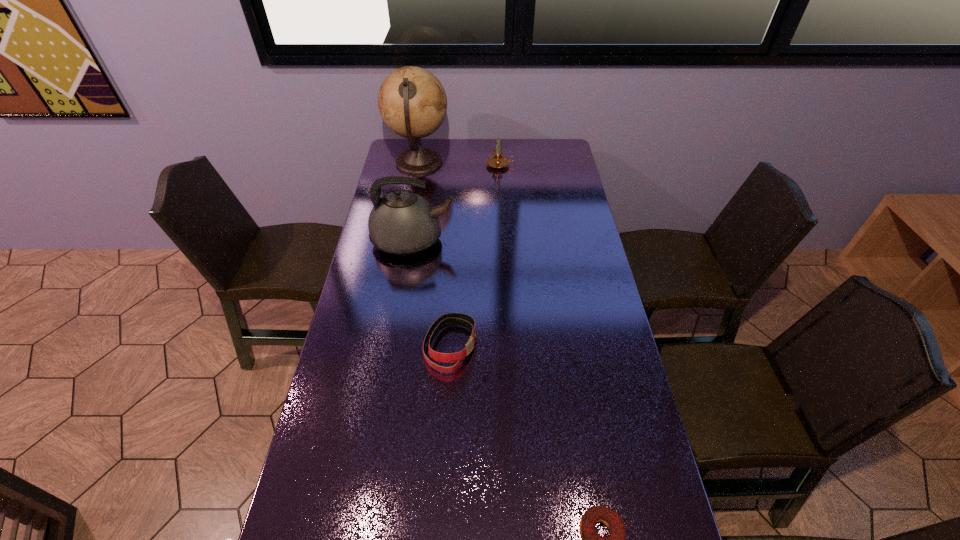
Identify the location of vacant area between the fourth farthest object and the second tallest object. This screenshot has height=540, width=960. (432, 293).

Locate an element on the screen. The image size is (960, 540). vacant region between the fourth tallest object and the third farthest object is located at coordinates (432, 293).

You are a GUI agent. You are given a task and a screenshot of the screen. Output one action in this format:
    pyautogui.click(x=<x>, y=<y>)
    Task: Click on the free space between the second object from right to left and the second shortest object
    The width and height of the screenshot is (960, 540).
    Given the screenshot: What is the action you would take?
    pyautogui.click(x=475, y=255)

Image resolution: width=960 pixels, height=540 pixels. Identify the location of unoccupied position between the fourth object from left to right and the tallest object. (460, 164).

In order to click on empty space between the kettle and the candle in this screenshot , I will do click(x=457, y=202).

The height and width of the screenshot is (540, 960). Find the location of `object that is the fourth closest to the fourth shortest object`. object that is the fourth closest to the fourth shortest object is located at coordinates (591, 539).

Identify which object is the nearest to the tallest object. Please provide its 2D coordinates. Your answer should be formatted as a tuple, i.e. [(x, y)], where the tuple contains the x and y coordinates of a point satisfying the conditions above.

[(497, 161)]

Find the location of `vacant position in the image that satisfies the following two spatial constraints: 1. on the front-facing side of the dog collar; 2. on the right side of the globe`. vacant position in the image that satisfies the following two spatial constraints: 1. on the front-facing side of the dog collar; 2. on the right side of the globe is located at coordinates (386, 346).

Find the location of a particular element. This screenshot has width=960, height=540. vacant space that satisfies the following two spatial constraints: 1. on the front-facing side of the tallest object; 2. on the right side of the second object from right to left is located at coordinates (419, 165).

Locate an element on the screen. blank area in the image that satisfies the following two spatial constraints: 1. on the back side of the fourth farthest object; 2. at the spout of the third nearest object is located at coordinates (457, 240).